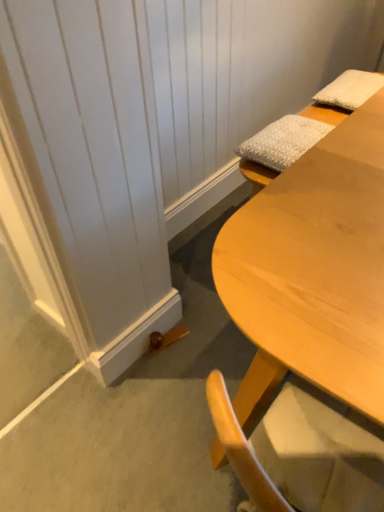
Question: Considering the positions of white textured pillow at upper right, the first pillow positioned from the left, and white textured pillow at upper right, positioned as the first pillow in right-to-left order, in the image, is white textured pillow at upper right, the first pillow positioned from the left, bigger or smaller than white textured pillow at upper right, positioned as the first pillow in right-to-left order,?

Choices:
 (A) small
 (B) big

Answer: (A)

Question: Does point (283, 128) appear closer or farther from the camera than point (319, 95)?

Choices:
 (A) farther
 (B) closer

Answer: (B)

Question: Which is farther from the white textured pillow at upper right, which is the 2th pillow from right to left?

Choices:
 (A) white textured pillow at upper right, positioned as the 2th pillow in front-to-back order
 (B) light wood desk at lower right

Answer: (B)

Question: Which object is positioned closest to the white textured pillow at upper right, arranged as the second pillow when ordered from the bottom?

Choices:
 (A) white textured pillow at upper right, which is the 2th pillow from right to left
 (B) light wood desk at lower right

Answer: (A)